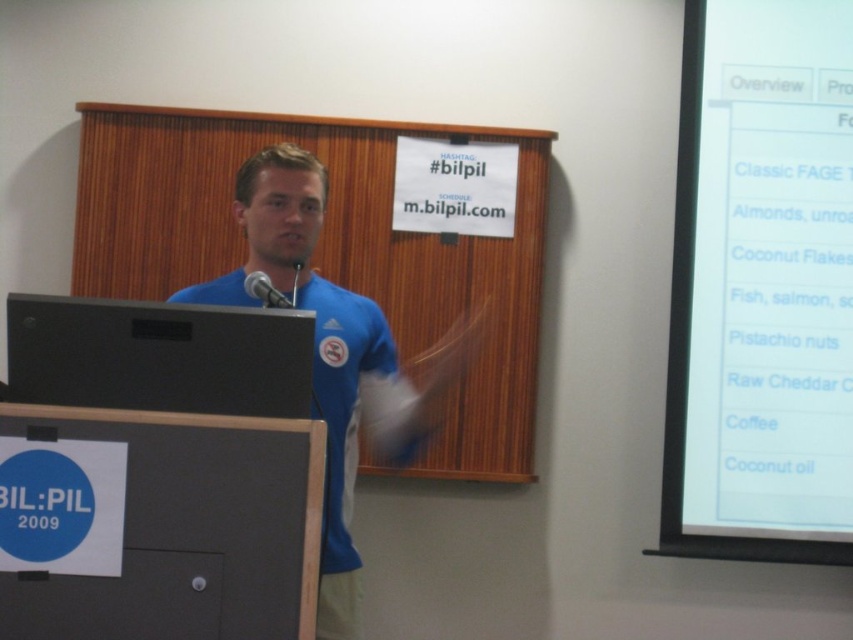
Based on the photo, who is lower down, white paper at upper right or black matte speaker at left?

black matte speaker at left

Is point (766, 22) closer to camera compared to point (56, 323)?

No, it is behind (56, 323).

This screenshot has width=853, height=640. I want to click on white paper at upper right, so coord(761,285).

Can you confirm if white paper at upper right is positioned to the left of black metallic microphone at center?

Incorrect, white paper at upper right is not on the left side of black metallic microphone at center.

The width and height of the screenshot is (853, 640). What do you see at coordinates (761, 285) in the screenshot?
I see `white paper at upper right` at bounding box center [761, 285].

Between point (738, 532) and point (247, 289), which one is positioned behind?

The point (738, 532) is more distant.

I want to click on white paper at upper right, so click(761, 285).

Can you confirm if wooden at center is positioned below black matte speaker at left?

Incorrect, wooden at center is not positioned below black matte speaker at left.

Is wooden at center thinner than black matte speaker at left?

Incorrect, wooden at center's width is not less than black matte speaker at left's.

Between point (515, 296) and point (91, 384), which one is positioned in front?

Point (91, 384) is in front.

Find the location of `wooden at center`. wooden at center is located at coordinates (328, 248).